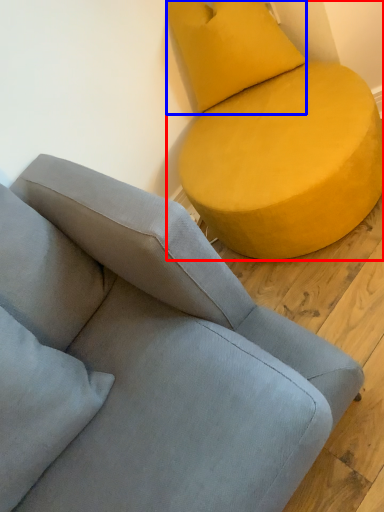
Question: Among these objects, which one is nearest to the camera, studio couch (highlighted by a red box) or pillow (highlighted by a blue box)?

Choices:
 (A) studio couch
 (B) pillow

Answer: (A)